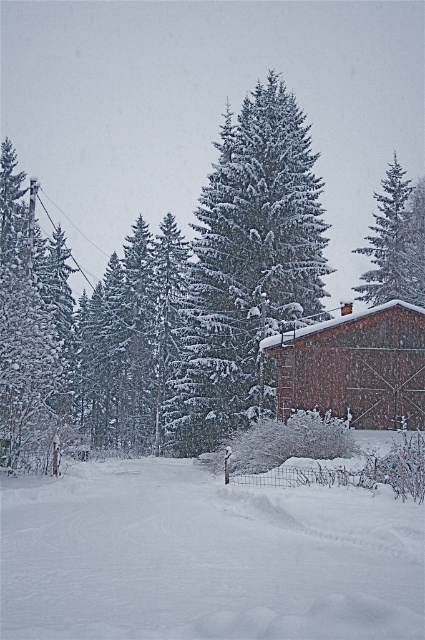
Is snow-covered evergreen tree at center wider than brown wooden cabin at center-right?

Yes, snow-covered evergreen tree at center is wider than brown wooden cabin at center-right.

Describe the element at coordinates (246, 268) in the screenshot. Image resolution: width=425 pixels, height=640 pixels. I see `snow-covered evergreen tree at center` at that location.

Identify the location of snow-covered evergreen tree at center. (246, 268).

Which is above, snow-covered evergreen tree at center or snow-covered pine tree at upper right?

snow-covered evergreen tree at center is above.

Does point (215, 220) come in front of point (401, 252)?

Yes, point (215, 220) is closer to viewer.

Is point (203, 232) less distant than point (385, 208)?

Yes, point (203, 232) is closer to viewer.

Locate an element on the screen. snow-covered evergreen tree at center is located at coordinates (246, 268).

Based on the photo, between white snow ski slope at center and snow-covered evergreen tree at center, which one has less height?

white snow ski slope at center is shorter.

This screenshot has width=425, height=640. Identify the location of white snow ski slope at center. (204, 557).

At what (x,y) coordinates should I click in order to perform the action: click on white snow ski slope at center. Please return your answer as a coordinate pair (x, y). Image resolution: width=425 pixels, height=640 pixels. Looking at the image, I should click on (204, 557).